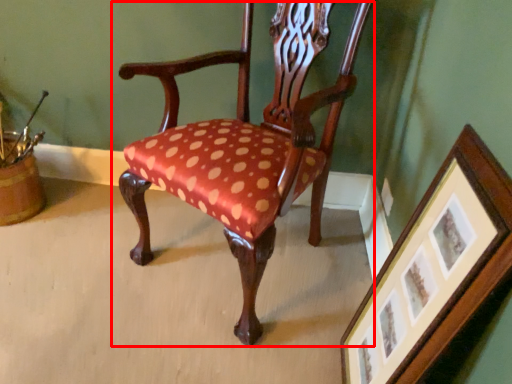
Question: From the image's perspective, what is the correct spatial positioning of chair (annotated by the red box) in reference to picture frame?

Choices:
 (A) above
 (B) below

Answer: (A)